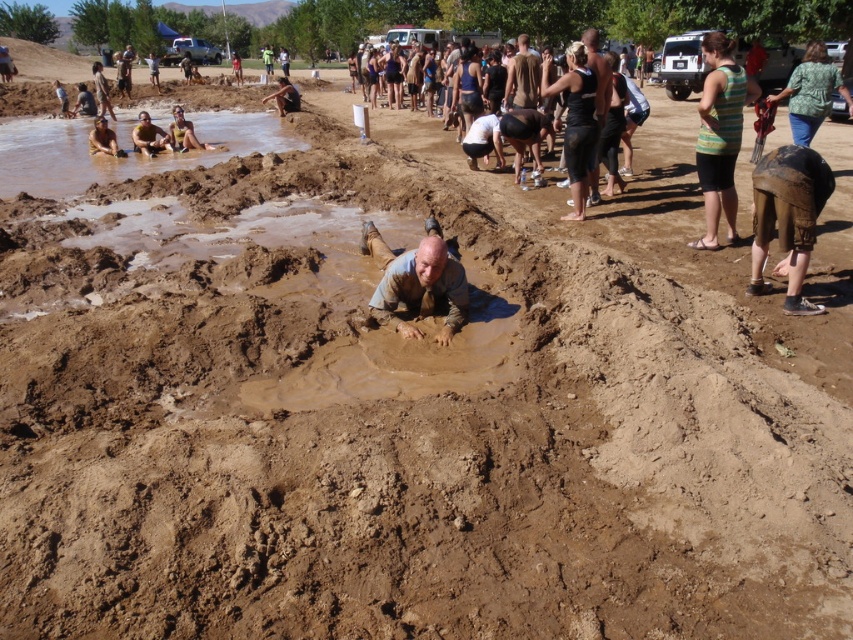
You are a photographer at the mud run event and need to capture a photo that includes both the brown leather shorts at lower left and matte black shorts at upper left. Given the distance between them, will you be able to fit both into your camera frame if your lens has a maximum field of view of 20 inches?

The brown leather shorts at lower left and matte black shorts at upper left are 21.92 inches apart from each other. Since the distance exceeds the camera lens field of view of 20 inches, you will not be able to fit both into the frame.

You are a participant at the mud run event and need to cross from the muddy pit to the observation area. You see the brown muddy water at upper left and the green striped tank top at right. Which object is higher in elevation?

The brown muddy water at upper left is much taller than the green striped tank top at right, so the brown muddy water at upper left is higher in elevation.